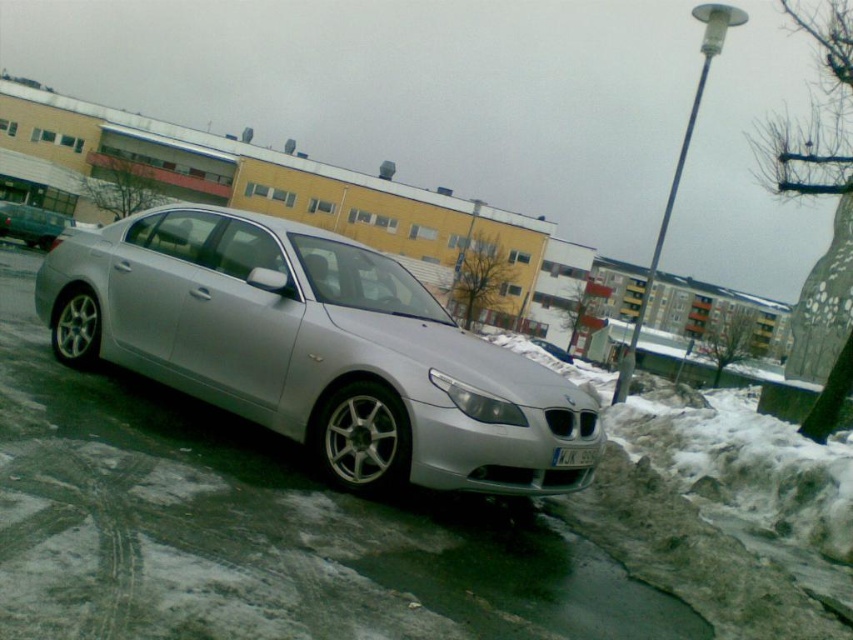
Based on the photo, you are a delivery person trying to park a new car that is exactly the same height as the satin silver car at center. There is a low hanging branch that is exactly the same height as the white plastic license plate at lower center. Will your car fit under the branch without hitting it?

The satin silver car at center is much taller than the white plastic license plate at lower center, so the car will hit the branch which is at the height of the license plate.

You are a delivery person trying to park your van behind the satin silver car at center. The van requires a clearance of 1 meter between the car and the white plastic license plate at lower center. Is there enough space?

The satin silver car at center is located above the white plastic license plate at lower center, but the exact distance isn not provided. Without knowing the vertical clearance between them, it is impossible to determine if the van has enough space to park behind the car.